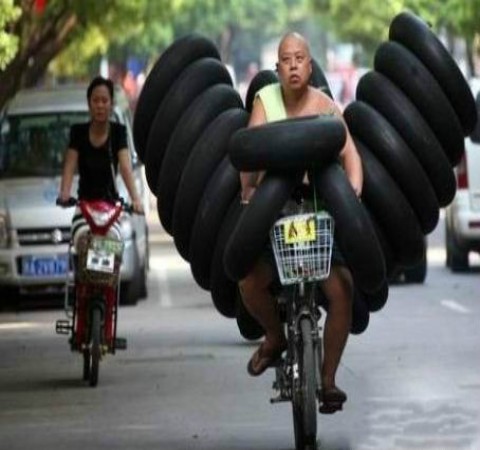
Locate an element on the screen. The height and width of the screenshot is (450, 480). wire basket is located at coordinates (315, 257).